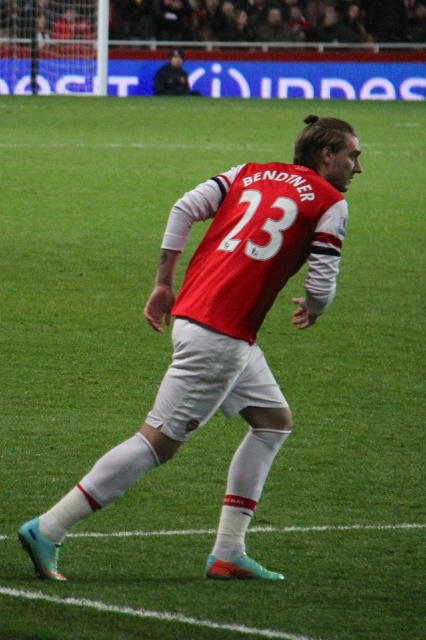
Question: Is red matte jersey at center to the left of matte red jersey at upper center from the viewer's perspective?

Choices:
 (A) yes
 (B) no

Answer: (B)

Question: Which of the following is the closest to the observer?

Choices:
 (A) (178, 72)
 (B) (268, 412)

Answer: (B)

Question: Is red matte jersey at center bigger than matte red jersey at upper center?

Choices:
 (A) yes
 (B) no

Answer: (A)

Question: Which object appears closest to the camera in this image?

Choices:
 (A) red matte jersey at center
 (B) matte red jersey at upper center

Answer: (A)

Question: Which point is farther to the camera?

Choices:
 (A) red matte jersey at center
 (B) matte red jersey at upper center

Answer: (B)

Question: Does red matte jersey at center have a lesser width compared to matte red jersey at upper center?

Choices:
 (A) yes
 (B) no

Answer: (B)